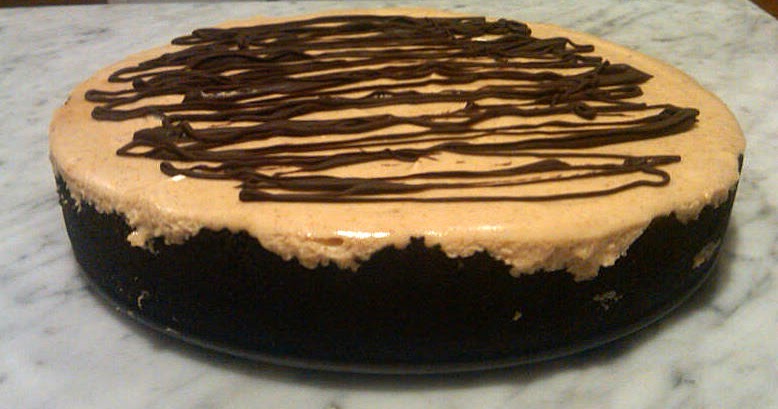
Image resolution: width=778 pixels, height=409 pixels. Find the location of `wood cabinet possibly`. wood cabinet possibly is located at coordinates (766, 5).